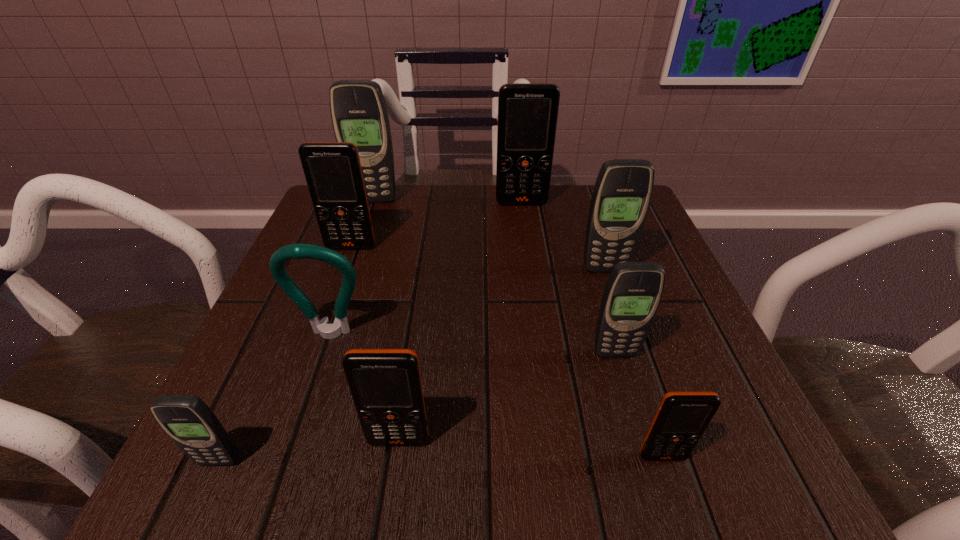
Find the location of a particular element. The image size is (960, 540). free spot at the near left corner of the desktop is located at coordinates (217, 466).

Where is `vacant space in between the nearest orange cellular telephone and the nearest gray cellular telephone`? The height and width of the screenshot is (540, 960). vacant space in between the nearest orange cellular telephone and the nearest gray cellular telephone is located at coordinates (441, 459).

Identify the location of empty location between the seventh nearest object and the sixth farthest cellular telephone. (375, 344).

Identify the location of free spot between the second biggest orange cellular telephone and the second smallest orange cellular telephone. (375, 344).

At what (x,y) coordinates should I click in order to perform the action: click on free space between the biggest orange cellular telephone and the second smallest orange cellular telephone. Please return your answer as a coordinate pair (x, y). This screenshot has width=960, height=540. Looking at the image, I should click on 460,322.

Find the location of a particular element. This screenshot has height=540, width=960. unoccupied position between the smallest gray cellular telephone and the nearest orange cellular telephone is located at coordinates (441, 459).

Locate an element on the screen. This screenshot has width=960, height=540. free space between the bottle opener and the fourth farthest object is located at coordinates tap(468, 302).

The image size is (960, 540). I want to click on vacant space in between the second nearest gray cellular telephone and the seventh nearest object, so click(483, 300).

The width and height of the screenshot is (960, 540). Identify the location of free space between the fourth farthest object and the fifth object from right to left. (502, 355).

The height and width of the screenshot is (540, 960). In order to click on empty location between the second biggest gray cellular telephone and the rightmost orange cellular telephone in this screenshot , I will do `click(634, 363)`.